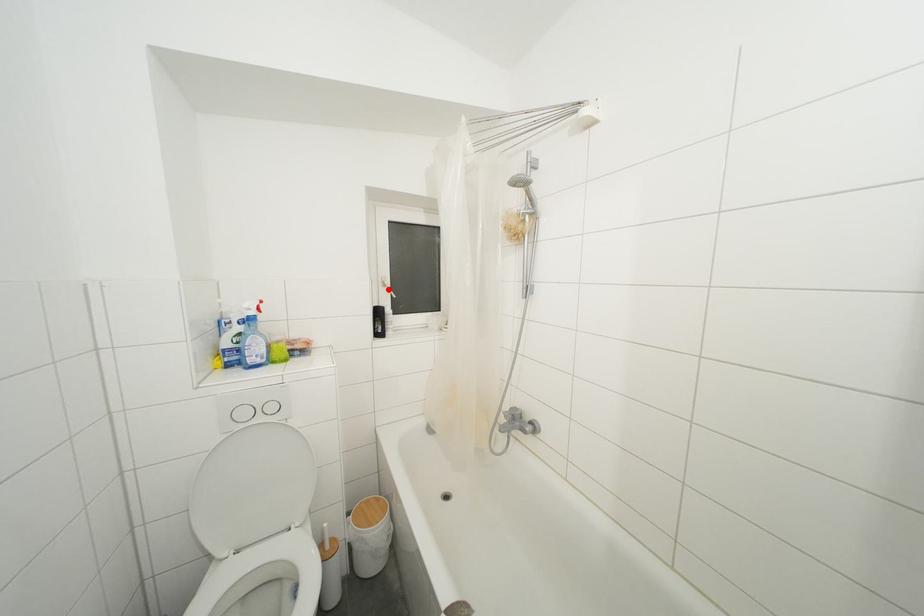
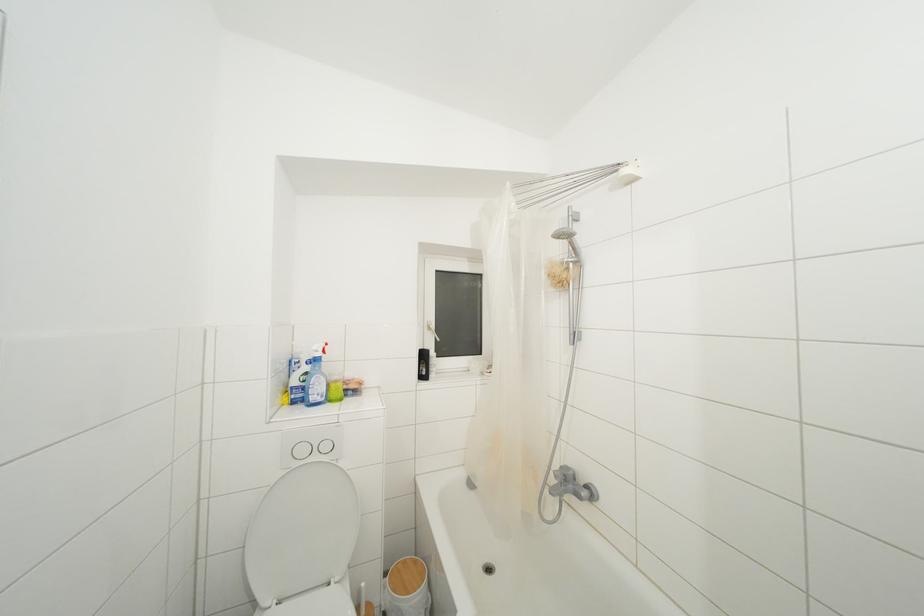
Locate, in the second image, the point that corresponds to the highlighted location in the first image.

(433, 333)